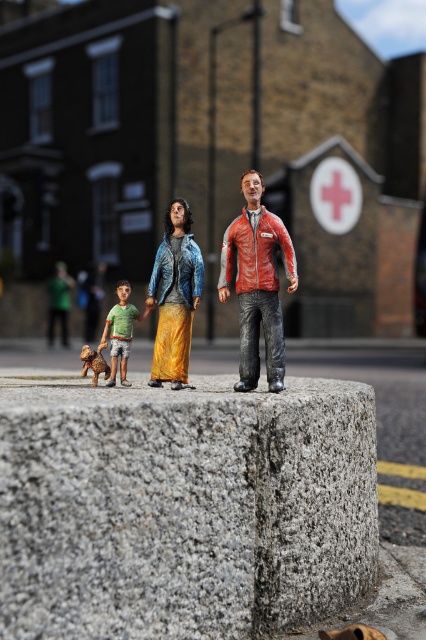
You are a photographer setting up a shot of the miniature scene. You want to ensure the leather jacket at center and the brown fur dog at lower left are both visible in the frame. Which object should you focus on first to make sure both are in focus?

You should focus on the leather jacket at center first because it is in front of the brown fur dog at lower left, so focusing on the closer object will ensure both are in focus.